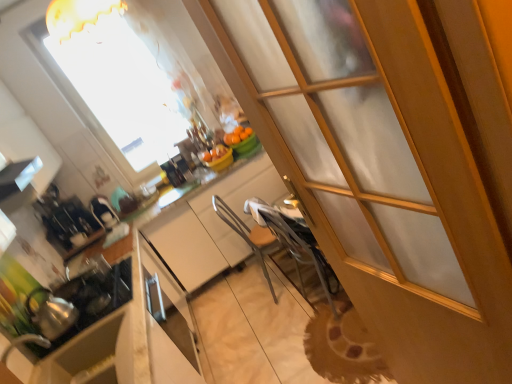
Question: Would you say metallic silver chair at center is outside transparent glass window at upper center?

Choices:
 (A) yes
 (B) no

Answer: (A)

Question: Is metallic silver chair at center looking in the opposite direction of transparent glass window at upper center?

Choices:
 (A) yes
 (B) no

Answer: (B)

Question: Is metallic silver chair at center with transparent glass window at upper center?

Choices:
 (A) no
 (B) yes

Answer: (A)

Question: Does metallic silver chair at center lie in front of transparent glass window at upper center?

Choices:
 (A) yes
 (B) no

Answer: (A)

Question: Does metallic silver chair at center have a greater width compared to transparent glass window at upper center?

Choices:
 (A) no
 (B) yes

Answer: (B)

Question: Considering the relative positions of metallic silver chair at center and transparent glass window at upper center in the image provided, is metallic silver chair at center to the right of transparent glass window at upper center from the viewer's perspective?

Choices:
 (A) no
 (B) yes

Answer: (B)

Question: From the image's perspective, is transparent glass screen door at center located above white glossy counter at center?

Choices:
 (A) no
 (B) yes

Answer: (B)

Question: From a real-world perspective, is transparent glass screen door at center beneath white glossy counter at center?

Choices:
 (A) no
 (B) yes

Answer: (A)

Question: Can you confirm if transparent glass screen door at center is smaller than white glossy counter at center?

Choices:
 (A) no
 (B) yes

Answer: (B)

Question: Can you confirm if transparent glass screen door at center is positioned to the left of white glossy counter at center?

Choices:
 (A) yes
 (B) no

Answer: (B)

Question: Is transparent glass screen door at center located outside white glossy counter at center?

Choices:
 (A) no
 (B) yes

Answer: (B)

Question: Is transparent glass screen door at center beside white glossy counter at center?

Choices:
 (A) no
 (B) yes

Answer: (A)

Question: From a real-world perspective, does transparent glass screen door at center stand above orange matte bowl at center?

Choices:
 (A) yes
 (B) no

Answer: (A)